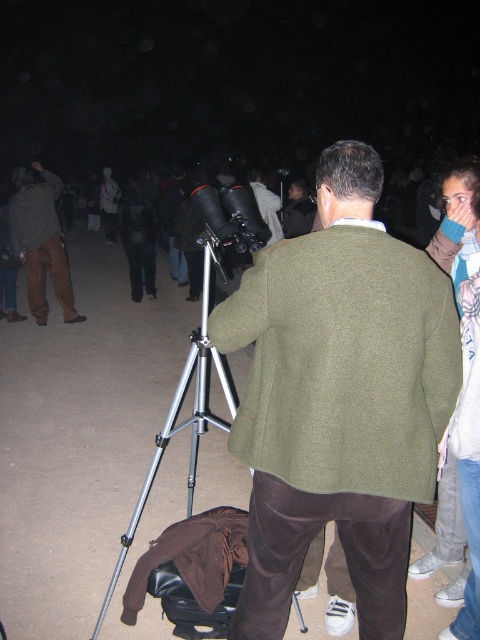
You are standing at the origin of the coordinate system in this nighttime astronomy scene. You want to place a new telescope stand at the point marked by the coordinate point at (x=186, y=419). However, there is already an object there. What object is located at that coordinate point?

The point at (x=186, y=419) corresponds to the silver metallic tripod at center, so the silver metallic tripod at center is located there.

You are trying to decide where to place your equipment in the astronomy setup. The silver metallic tripod at center and the brown cotton pants at left are both in your way. Which object should you move to free up more space?

The silver metallic tripod at center is larger in size than the brown cotton pants at left, so you should move the silver metallic tripod at center to free up more space.